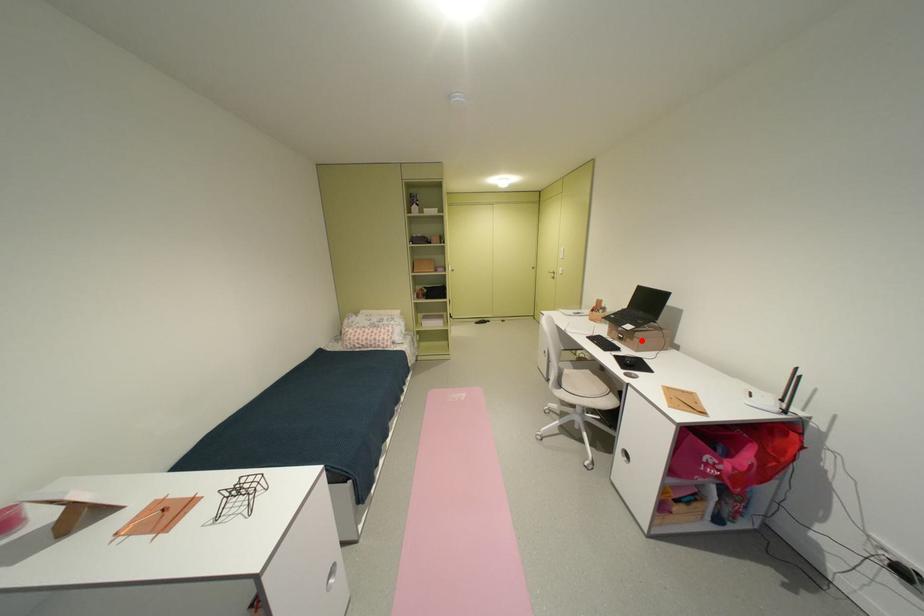
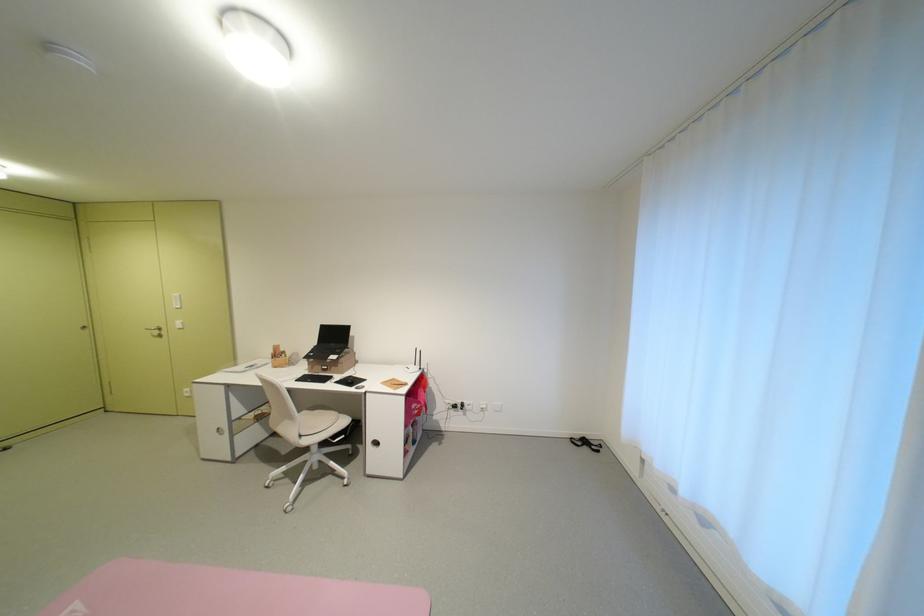
Question: I am providing you with two images of the same scene from different viewpoints. Given a red point in image1, look at the same physical point in image2. Is it:

Choices:
 (A) Closer to the viewpoint
 (B) Farther from the viewpoint

Answer: (B)